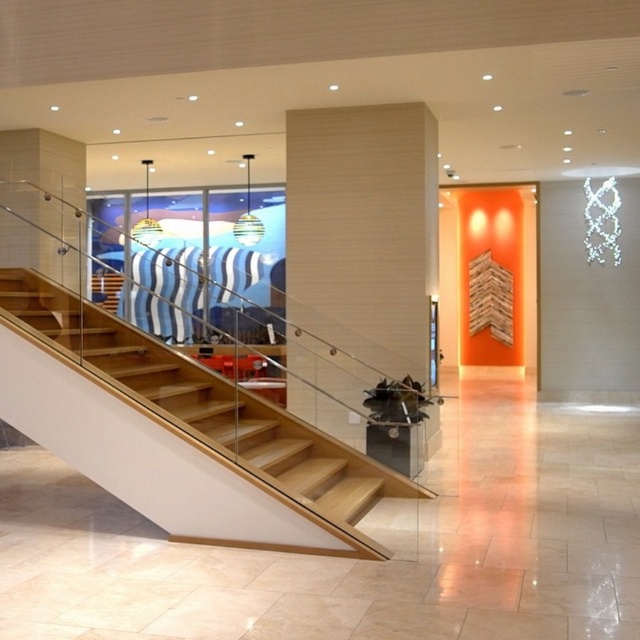
Question: Is wooden pillar at center thinner than wooden stairs at center?

Choices:
 (A) no
 (B) yes

Answer: (B)

Question: Does wooden pillar at center come behind wooden stairs at center?

Choices:
 (A) yes
 (B) no

Answer: (A)

Question: Which of the following is the closest to the observer?

Choices:
 (A) wooden pillar at center
 (B) wooden stairs at center

Answer: (B)

Question: Among these points, which one is farthest from the camera?

Choices:
 (A) (429, 144)
 (B) (269, 413)

Answer: (A)

Question: Is wooden pillar at center to the left of wooden stairs at center from the viewer's perspective?

Choices:
 (A) yes
 (B) no

Answer: (B)

Question: Which point is farther to the camera?

Choices:
 (A) (352, 458)
 (B) (413, 305)

Answer: (B)